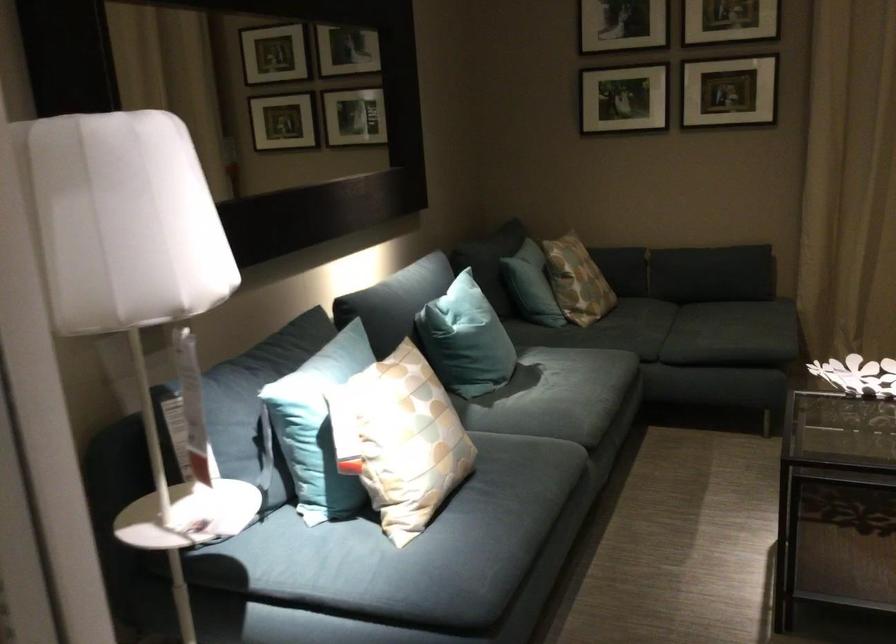
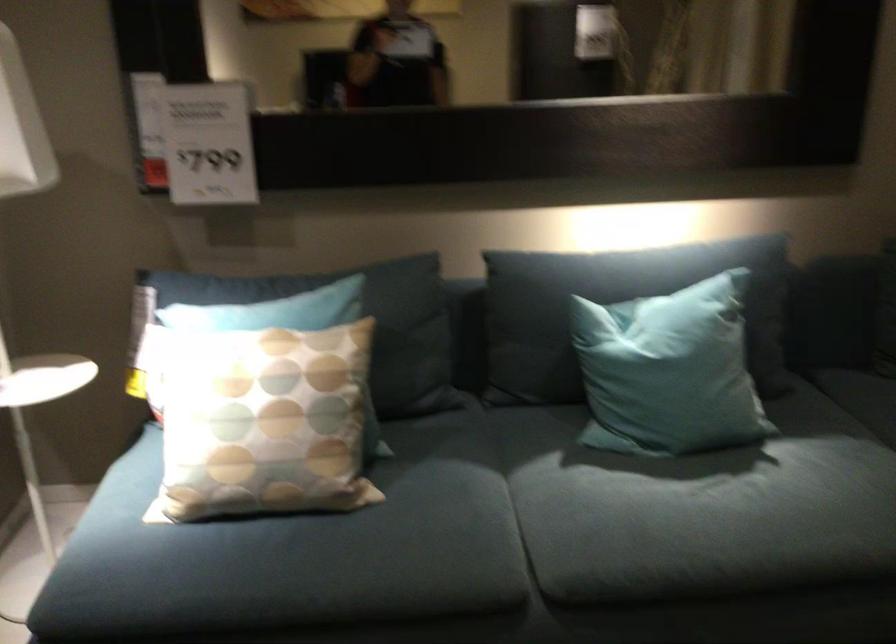
The point at (492, 330) is marked in the first image. Where is the corresponding point in the second image?

(668, 371)